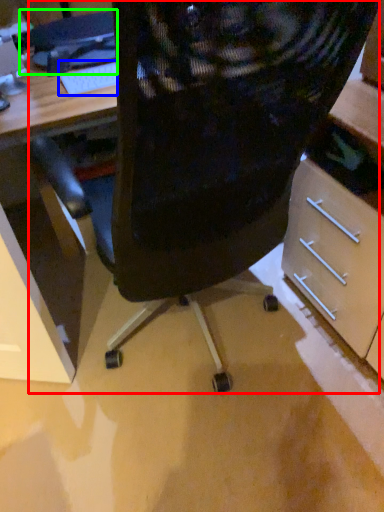
Question: Which object is the closest to the chair (highlighted by a red box)? Choose among these: keyboard (highlighted by a blue box) or computer (highlighted by a green box).

Choices:
 (A) keyboard
 (B) computer

Answer: (A)